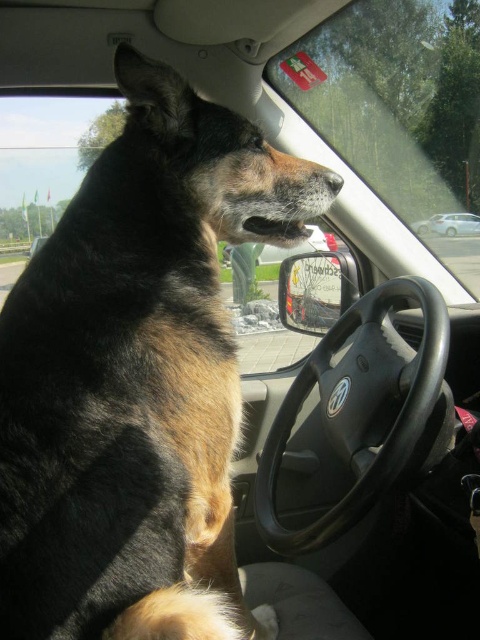
You are sitting in the passenger seat of a Volkswagen car and see the point marked at coordinates (398, 108). What object in the car corresponds to this point?

The transparent glass window at upper center corresponds to the point marked at coordinates (398, 108).

You are a mechanic checking the car interior. You need to determine if the black fur dog at left can fit under the black leather steering wheel at center. Based on their sizes, what is your assessment?

The black fur dog at left is bigger than the black leather steering wheel at center, so it cannot fit under the steering wheel.

You are a passenger in the car and want to look outside through the transparent glass window at upper center while avoiding touching the black leather steering wheel at center. Can you do this without moving your head?

The transparent glass window at upper center is wider than the black leather steering wheel at center, so yes, you can look outside through the transparent glass window at upper center without moving your head while avoiding the black leather steering wheel at center.